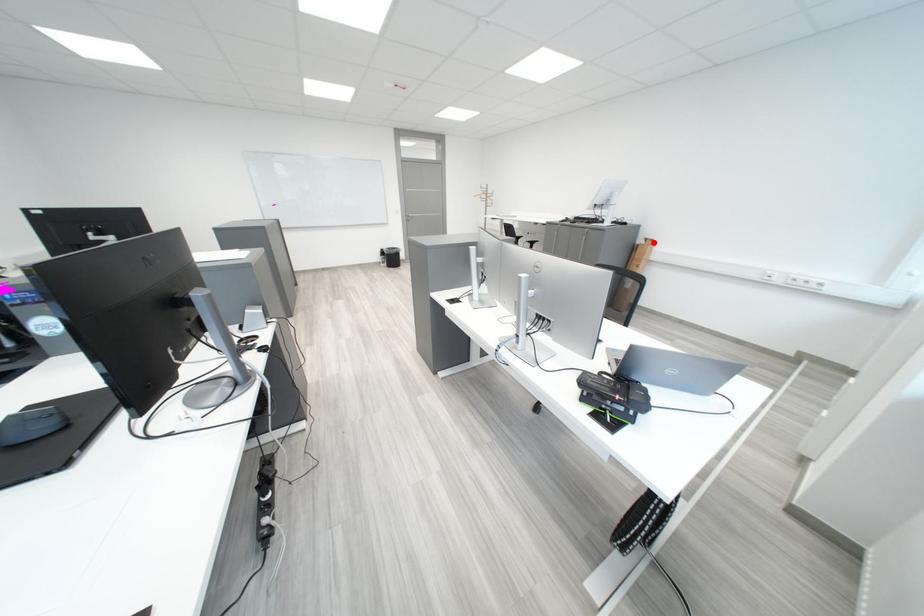
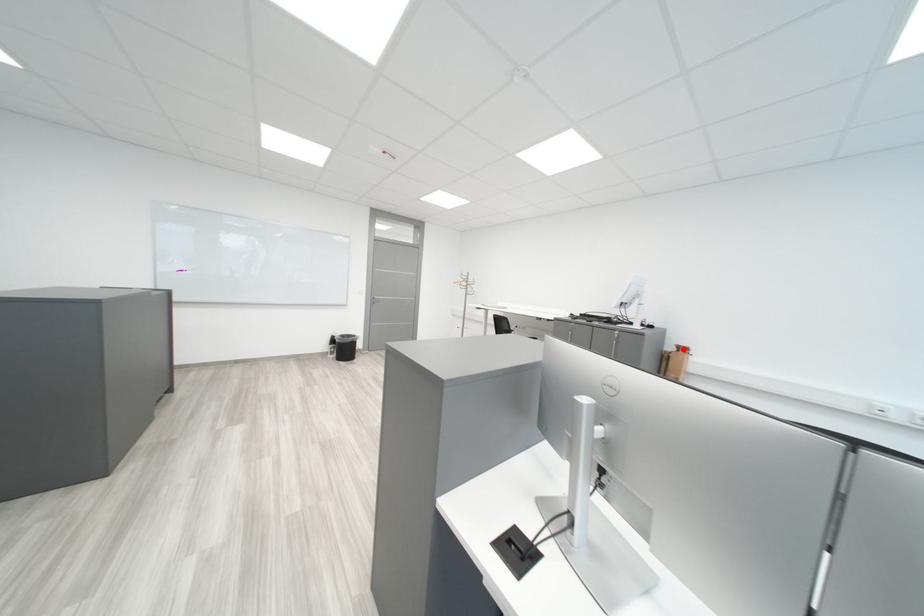
I am providing you with two images of the same scene from different viewpoints. A red point is marked on the first image and another point is marked on the second image. Is the marked point in image1 the same physical position as the marked point in image2?

Yes